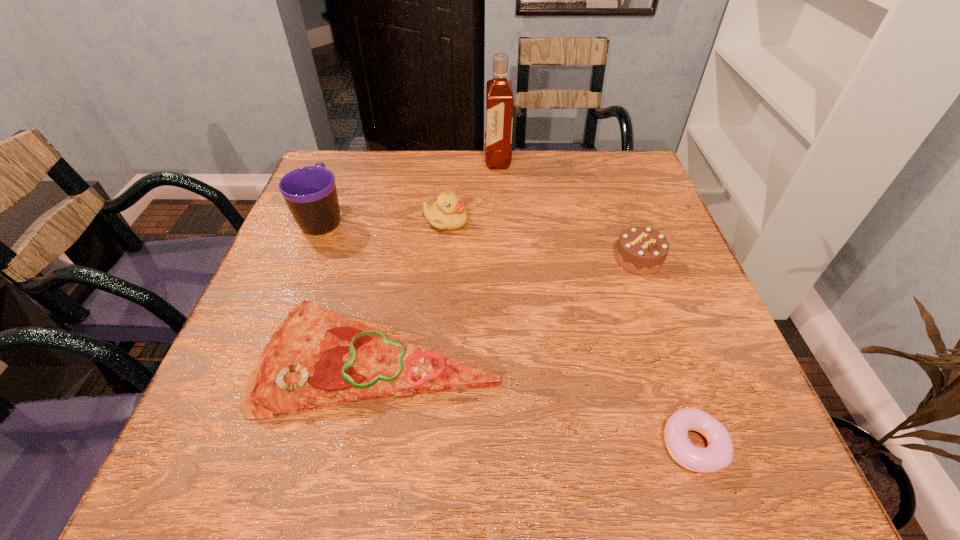
This screenshot has width=960, height=540. What are the coordinates of `free space located with the handle on the side of the mug` in the screenshot? It's located at (339, 178).

Locate an element on the screen. Image resolution: width=960 pixels, height=540 pixels. free space located with the handle on the side of the mug is located at coordinates (342, 172).

At what (x,y) coordinates should I click in order to perform the action: click on free space located 0.240m with the handle on the side of the mug. Please return your answer as a coordinate pair (x, y). The width and height of the screenshot is (960, 540). Looking at the image, I should click on (350, 150).

At what (x,y) coordinates should I click in order to perform the action: click on free location located 0.190m on the front-facing side of the duckling. Please return your answer as a coordinate pair (x, y). Looking at the image, I should click on (545, 221).

The width and height of the screenshot is (960, 540). I want to click on vacant space located on the back of the chocolate cake, so click(609, 178).

Locate an element on the screen. The width and height of the screenshot is (960, 540). vacant space situated 0.200m on the back of the pizza is located at coordinates (402, 243).

In order to click on vacant space situated on the left of the doughnut in this screenshot , I will do `click(414, 444)`.

The height and width of the screenshot is (540, 960). What are the coordinates of `liquor that is positioned at the far edge` in the screenshot? It's located at (499, 93).

Where is `mug that is at the far edge`? mug that is at the far edge is located at coordinates (310, 192).

Identify the location of object situated at the near edge. (719, 453).